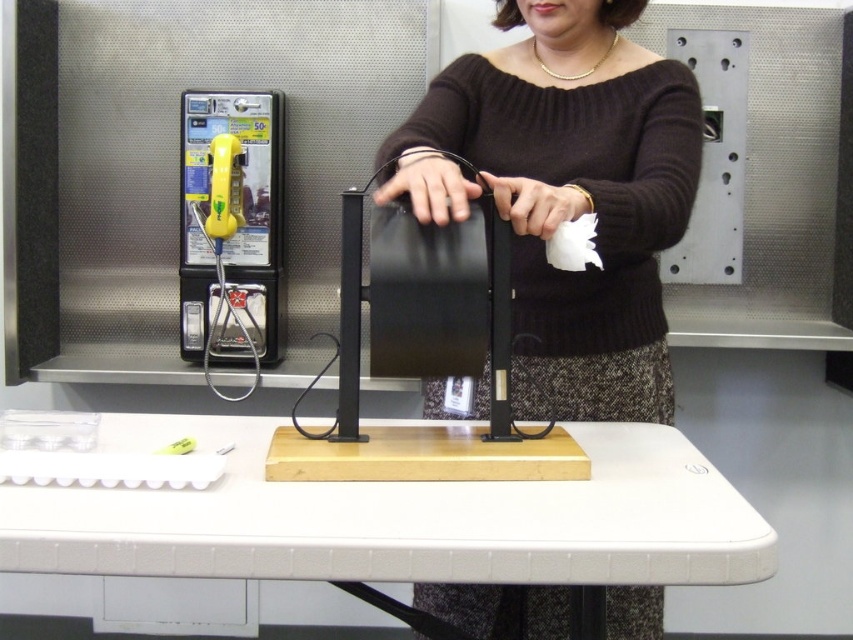
Does knitted dark brown sweater at center have a lesser width compared to yellow plastic phone at left?

No, knitted dark brown sweater at center is not thinner than yellow plastic phone at left.

From the picture: Measure the distance from knitted dark brown sweater at center to yellow plastic phone at left.

A distance of 36.65 inches exists between knitted dark brown sweater at center and yellow plastic phone at left.

Identify the location of knitted dark brown sweater at center. (567, 195).

Image resolution: width=853 pixels, height=640 pixels. Find the location of `knitted dark brown sweater at center`. knitted dark brown sweater at center is located at coordinates (567, 195).

What are the coordinates of `knitted dark brown sweater at center` in the screenshot? It's located at (567, 195).

Does knitted dark brown sweater at center lie behind white plastic table at center?

That is True.

Who is more forward, [547,129] or [483,493]?

Point [483,493] is more forward.

This screenshot has height=640, width=853. What are the coordinates of `knitted dark brown sweater at center` in the screenshot? It's located at (567, 195).

Does point (643, 538) come behind point (242, 257)?

No, it is in front of (242, 257).

Between white plastic table at center and yellow plastic phone at left, which one is positioned lower?

white plastic table at center

The image size is (853, 640). I want to click on white plastic table at center, so click(397, 518).